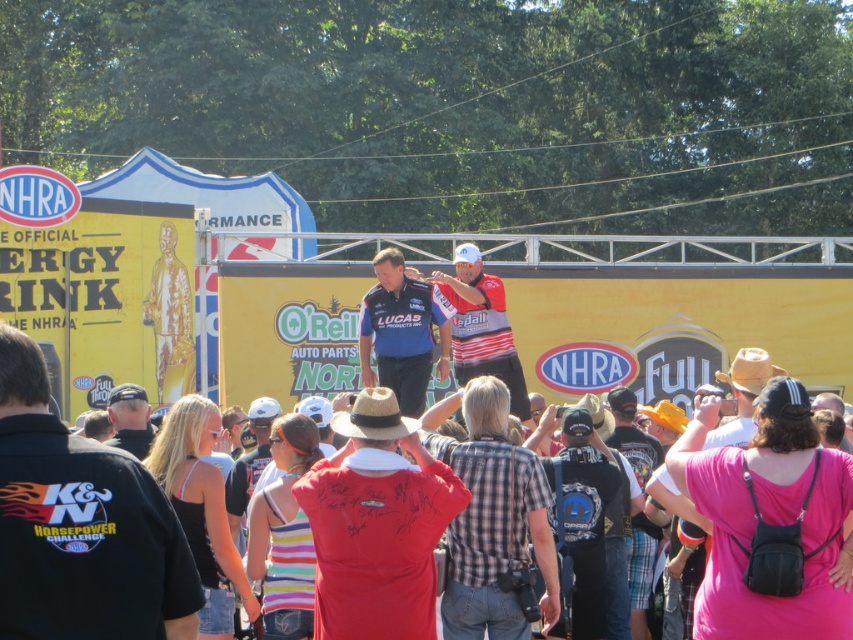
Question: Is black cotton shirt at center closer to camera compared to tan straw cowboy hat at upper right?

Choices:
 (A) yes
 (B) no

Answer: (A)

Question: Which point appears farthest from the camera in this image?

Choices:
 (A) (525, 385)
 (B) (372, 296)
 (C) (743, 388)
 (D) (160, 493)

Answer: (B)

Question: Can you confirm if black cotton shirt at center is positioned below striped jersey at center?

Choices:
 (A) no
 (B) yes

Answer: (B)

Question: Among these objects, which one is farthest from the camera?

Choices:
 (A) brown straw cowboy hat at center
 (B) black cap at center
 (C) blue jersey at center
 (D) black cotton shirt at center

Answer: (C)

Question: Is brown straw cowboy hat at center thinner than black cap at center?

Choices:
 (A) no
 (B) yes

Answer: (B)

Question: Which point is farther to the camera?

Choices:
 (A) (410, 269)
 (B) (115, 408)
 (C) (750, 381)
 (D) (399, 384)

Answer: (A)